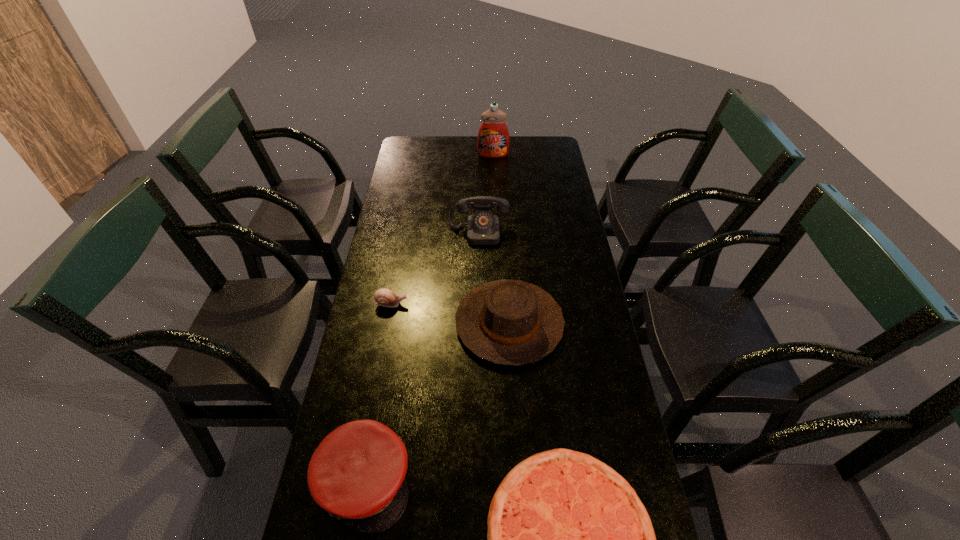
In order to click on vacant space that satisfies the following two spatial constraints: 1. on the dial of the second farthest object; 2. on the right side of the cowboy hat in this screenshot , I will do `click(478, 323)`.

Image resolution: width=960 pixels, height=540 pixels. Find the location of `free spot that satisfies the following two spatial constraints: 1. on the front surface of the farthest object; 2. on the front-facing side of the escargot`. free spot that satisfies the following two spatial constraints: 1. on the front surface of the farthest object; 2. on the front-facing side of the escargot is located at coordinates (499, 303).

Identify the location of vacant space that satisfies the following two spatial constraints: 1. on the dial of the cowboy hat; 2. on the left side of the fifth nearest object. The image size is (960, 540). (478, 323).

I want to click on vacant area in the image that satisfies the following two spatial constraints: 1. on the front surface of the tallest object; 2. on the front-facing side of the escargot, so click(499, 303).

At what (x,y) coordinates should I click in order to perform the action: click on free space that satisfies the following two spatial constraints: 1. on the dial of the telephone; 2. at the front of the cap where the visor is located. Please return your answer as a coordinate pair (x, y). Looking at the image, I should click on (478, 482).